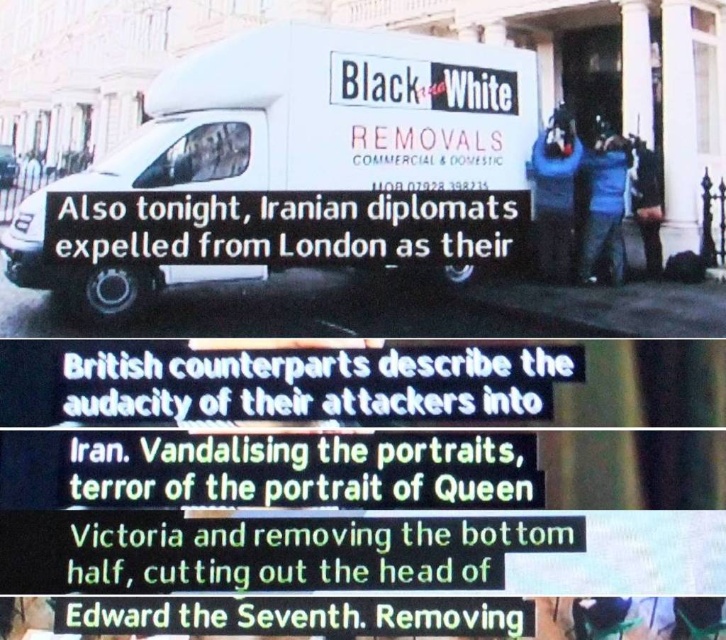
You are a news anchor standing in front of the white matte van at center and the blue jeans at lower right. You need to point to the van first and then the jeans. In which direction should you move your hand from the van to the jeans?

You should move your hand to the right from the white matte van at center to the blue jeans at lower right because the van is to the left of the jeans.

You are a news anchor standing in front of the white van. You need to point to two specific points on the van to highlight important details. The first point is at coordinate point [554,163] and the second point is at coordinate point [613,275]. Which point should you point to first if you want to start with the one closer to you?

You should point to point [554,163] first because it is closer to you than point [613,275].

You are a delivery driver who needs to park your van in a space that can only accommodate vehicles up to the width of the blue jeans at lower right. Can your white matte van at center fit in that space?

The white matte van at center is wider than the blue jeans at lower right, so it cannot fit in the parking space designated for vehicles up to the width of the blue jeans at lower right.